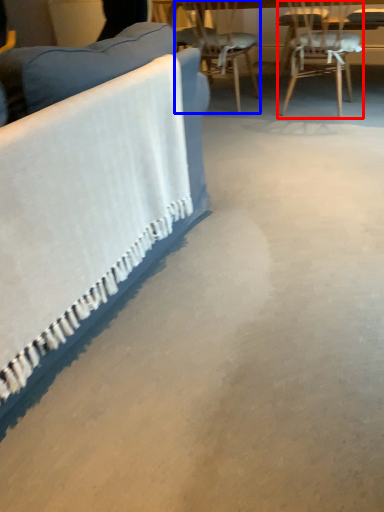
Question: Which point is closer to the camera, chair (highlighted by a red box) or chair (highlighted by a blue box)?

Choices:
 (A) chair
 (B) chair

Answer: (A)